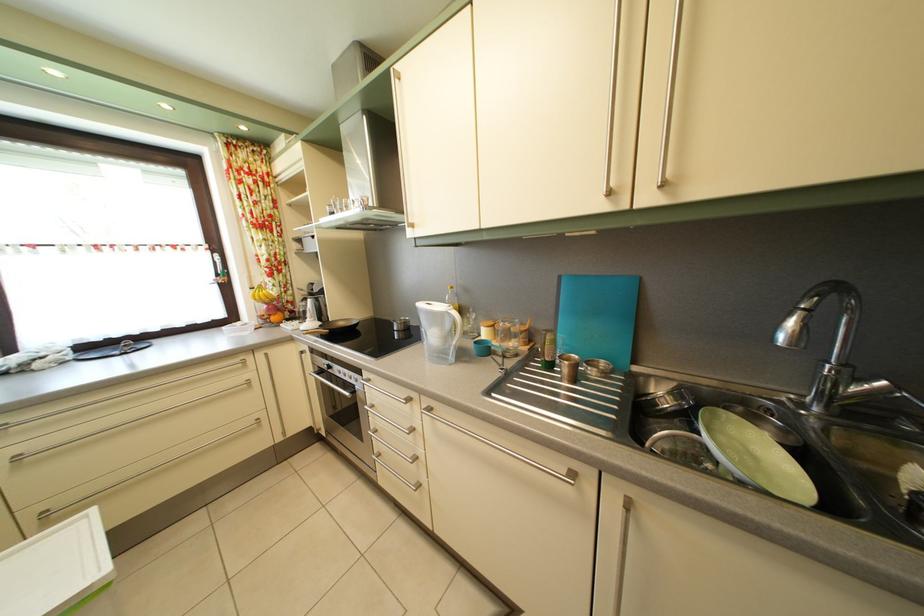
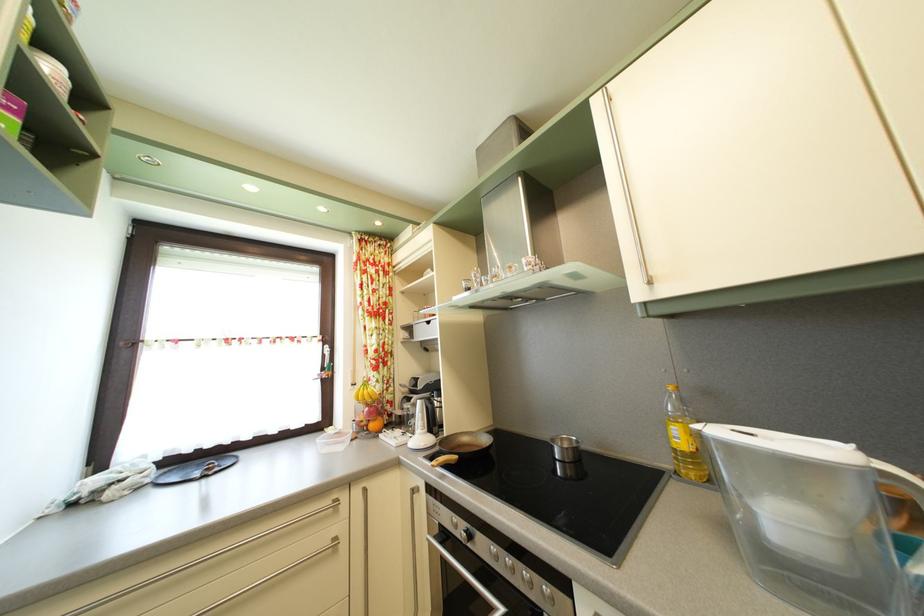
In a continuous first-person perspective shot, in which direction is the camera moving?

The movement direction of the cameraman is left, forward.